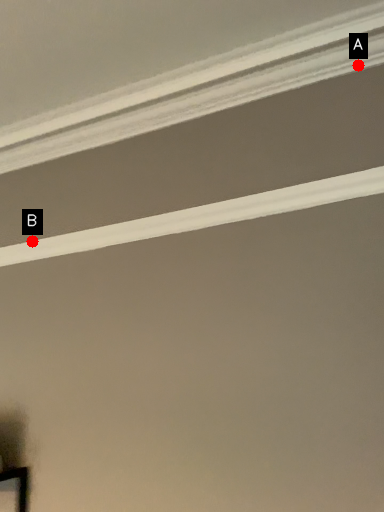
Question: Two points are circled on the image, labeled by A and B beside each circle. Which point appears farthest from the camera in this image?

Choices:
 (A) A is further
 (B) B is further

Answer: (B)